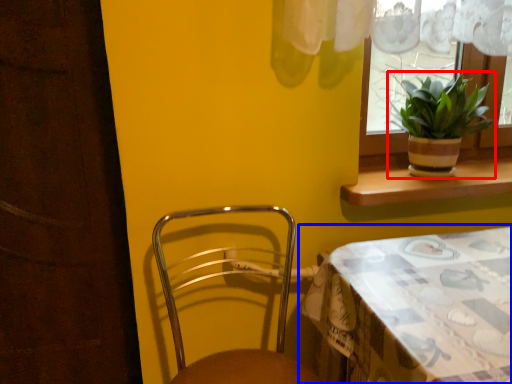
Question: Which point is closer to the camera, houseplant (highlighted by a red box) or table (highlighted by a blue box)?

Choices:
 (A) houseplant
 (B) table

Answer: (B)